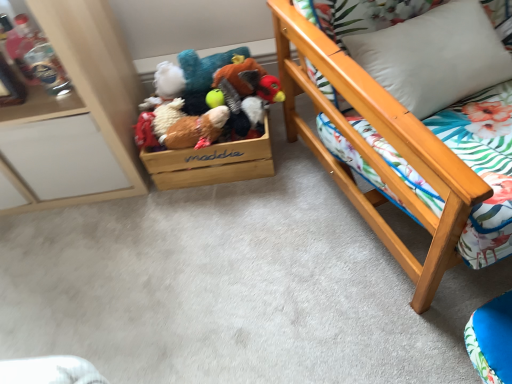
Find the location of a particular element. The width and height of the screenshot is (512, 384). fluffy brown plush at center, acting as the first toy starting from the front is located at coordinates (196, 130).

Measure the distance between fluffy brown plush at center, marked as the second toy in a back-to-front arrangement, and camera.

fluffy brown plush at center, marked as the second toy in a back-to-front arrangement, and camera are 4.20 feet apart.

How much space does wooden cabinet at left, positioned as the second furniture in right-to-left order, occupy horizontally?

The width of wooden cabinet at left, positioned as the second furniture in right-to-left order, is 16.26 inches.

In order to click on wooden plush toys at center, the first toy in the back-to-front sequence in this screenshot , I will do [x=206, y=101].

Image resolution: width=512 pixels, height=384 pixels. In order to click on wooden bed frame at right, arranged as the 2th furniture when viewed from the left in this screenshot , I will do `click(375, 151)`.

Considering the relative sizes of wooden cabinet at left, the 1th furniture from the left, and wooden bed frame at right, arranged as the 2th furniture when viewed from the left, in the image provided, is wooden cabinet at left, the 1th furniture from the left, thinner than wooden bed frame at right, arranged as the 2th furniture when viewed from the left,?

Correct, the width of wooden cabinet at left, the 1th furniture from the left, is less than that of wooden bed frame at right, arranged as the 2th furniture when viewed from the left.

Looking at the image, does wooden cabinet at left, positioned as the second furniture in right-to-left order, seem bigger or smaller compared to wooden bed frame at right, arranged as the 2th furniture when viewed from the left?

In the image, wooden cabinet at left, positioned as the second furniture in right-to-left order, appears to be smaller than wooden bed frame at right, arranged as the 2th furniture when viewed from the left.

Between wooden cabinet at left, the 1th furniture from the left, and wooden bed frame at right, which appears as the 1th furniture when viewed from the right, which one appears on the right side from the viewer's perspective?

wooden bed frame at right, which appears as the 1th furniture when viewed from the right.

Consider the image. Are wooden cabinet at left, the 1th furniture from the left, and wooden bed frame at right, arranged as the 2th furniture when viewed from the left, located far from each other?

wooden cabinet at left, the 1th furniture from the left, is near wooden bed frame at right, arranged as the 2th furniture when viewed from the left, not far away.

Based on the photo, is wooden cabinet at left, the 1th furniture from the left, inside or outside of wooden plush toys at center, the first toy in the back-to-front sequence?

wooden cabinet at left, the 1th furniture from the left, is not inside wooden plush toys at center, the first toy in the back-to-front sequence, it's outside.

Find the location of a particular element. the 2nd toy to the right when counting from the wooden cabinet at left, positioned as the second furniture in right-to-left order is located at coordinates (206, 101).

From a real-world perspective, who is located higher, wooden cabinet at left, positioned as the second furniture in right-to-left order, or wooden plush toys at center, the first toy in the back-to-front sequence?

wooden cabinet at left, positioned as the second furniture in right-to-left order, from a real-world perspective.

From the image's perspective, is wooden cabinet at left, positioned as the second furniture in right-to-left order, under wooden plush toys at center, which is counted as the 2th toy, starting from the front?

Actually, wooden cabinet at left, positioned as the second furniture in right-to-left order, appears above wooden plush toys at center, which is counted as the 2th toy, starting from the front, in the image.

Does wooden plush toys at center, which is counted as the 2th toy, starting from the front, have a larger size compared to fluffy brown plush at center, marked as the second toy in a back-to-front arrangement?

Yes.

Considering the positions of points (198, 68) and (207, 128), is point (198, 68) farther from camera compared to point (207, 128)?

Yes.

Is wooden plush toys at center, the first toy in the back-to-front sequence, at the right side of fluffy brown plush at center, acting as the first toy starting from the front?

Yes, wooden plush toys at center, the first toy in the back-to-front sequence, is to the right of fluffy brown plush at center, acting as the first toy starting from the front.

Considering the sizes of objects wooden plush toys at center, the first toy in the back-to-front sequence, and fluffy brown plush at center, acting as the first toy starting from the front, in the image provided, who is shorter, wooden plush toys at center, the first toy in the back-to-front sequence, or fluffy brown plush at center, acting as the first toy starting from the front,?

fluffy brown plush at center, acting as the first toy starting from the front.

Which is behind, point (423, 33) or point (459, 236)?

Point (423, 33)

Is white soft pillow at upper right not close to wooden bed frame at right, which appears as the 1th furniture when viewed from the right?

No, white soft pillow at upper right is in close proximity to wooden bed frame at right, which appears as the 1th furniture when viewed from the right.

Could you measure the distance between white soft pillow at upper right and wooden bed frame at right, which appears as the 1th furniture when viewed from the right?

The distance of white soft pillow at upper right from wooden bed frame at right, which appears as the 1th furniture when viewed from the right, is 9.59 inches.

Consider the image. From a real-world perspective, between white soft pillow at upper right and wooden bed frame at right, which appears as the 1th furniture when viewed from the right, who is vertically lower?

wooden bed frame at right, which appears as the 1th furniture when viewed from the right, from a real-world perspective.

Is wooden bed frame at right, which appears as the 1th furniture when viewed from the right, oriented towards white soft pillow at upper right?

Yes, wooden bed frame at right, which appears as the 1th furniture when viewed from the right, is aimed at white soft pillow at upper right.

Looking at this image, looking at their sizes, would you say wooden bed frame at right, arranged as the 2th furniture when viewed from the left, is wider or thinner than white soft pillow at upper right?

Clearly, wooden bed frame at right, arranged as the 2th furniture when viewed from the left, has more width compared to white soft pillow at upper right.

Where is `the 2nd toy located beneath the wooden cabinet at left, positioned as the second furniture in right-to-left order (from a real-world perspective)`? Image resolution: width=512 pixels, height=384 pixels. the 2nd toy located beneath the wooden cabinet at left, positioned as the second furniture in right-to-left order (from a real-world perspective) is located at coordinates tap(206, 101).

Is wooden plush toys at center, the first toy in the back-to-front sequence, situated inside wooden cabinet at left, the 1th furniture from the left, or outside?

wooden plush toys at center, the first toy in the back-to-front sequence, is not enclosed by wooden cabinet at left, the 1th furniture from the left.

Which is more to the left, wooden plush toys at center, the first toy in the back-to-front sequence, or wooden cabinet at left, positioned as the second furniture in right-to-left order?

Positioned to the left is wooden cabinet at left, positioned as the second furniture in right-to-left order.

Who is bigger, wooden plush toys at center, which is counted as the 2th toy, starting from the front, or wooden cabinet at left, the 1th furniture from the left?

With larger size is wooden cabinet at left, the 1th furniture from the left.

From a real-world perspective, is wooden bed frame at right, arranged as the 2th furniture when viewed from the left, located higher than fluffy brown plush at center, acting as the first toy starting from the front?

Yes, from a real-world perspective, wooden bed frame at right, arranged as the 2th furniture when viewed from the left, is above fluffy brown plush at center, acting as the first toy starting from the front.

Looking at this image, considering the relative sizes of wooden bed frame at right, which appears as the 1th furniture when viewed from the right, and fluffy brown plush at center, acting as the first toy starting from the front, in the image provided, is wooden bed frame at right, which appears as the 1th furniture when viewed from the right, taller than fluffy brown plush at center, acting as the first toy starting from the front,?

Yes, wooden bed frame at right, which appears as the 1th furniture when viewed from the right, is taller than fluffy brown plush at center, acting as the first toy starting from the front.

How different are the orientations of wooden bed frame at right, which appears as the 1th furniture when viewed from the right, and fluffy brown plush at center, acting as the first toy starting from the front, in degrees?

They differ by 20 degrees in their facing directions.

Considering the sizes of wooden bed frame at right, arranged as the 2th furniture when viewed from the left, and fluffy brown plush at center, marked as the second toy in a back-to-front arrangement, in the image, is wooden bed frame at right, arranged as the 2th furniture when viewed from the left, bigger or smaller than fluffy brown plush at center, marked as the second toy in a back-to-front arrangement,?

Considering their sizes, wooden bed frame at right, arranged as the 2th furniture when viewed from the left, takes up more space than fluffy brown plush at center, marked as the second toy in a back-to-front arrangement.

The image size is (512, 384). What are the coordinates of `furniture above the wooden cabinet at left, positioned as the second furniture in right-to-left order (from a real-world perspective)` in the screenshot? It's located at (375, 151).

Where is `the 2nd toy counting from the right side of the wooden cabinet at left, the 1th furniture from the left`? The height and width of the screenshot is (384, 512). the 2nd toy counting from the right side of the wooden cabinet at left, the 1th furniture from the left is located at coordinates (206, 101).

Looking at this image, when comparing their distances from wooden cabinet at left, positioned as the second furniture in right-to-left order, does wooden plush toys at center, the first toy in the back-to-front sequence, or fluffy brown plush at center, marked as the second toy in a back-to-front arrangement, seem closer?

Among the two, wooden plush toys at center, the first toy in the back-to-front sequence, is located nearer to wooden cabinet at left, positioned as the second furniture in right-to-left order.

When comparing their distances from wooden plush toys at center, the first toy in the back-to-front sequence, does white soft pillow at upper right or wooden cabinet at left, the 1th furniture from the left, seem closer?

wooden cabinet at left, the 1th furniture from the left, is positioned closer to the anchor wooden plush toys at center, the first toy in the back-to-front sequence.

Looking at the image, which one is located closer to fluffy brown plush at center, acting as the first toy starting from the front, white soft pillow at upper right or wooden cabinet at left, positioned as the second furniture in right-to-left order?

Among the two, wooden cabinet at left, positioned as the second furniture in right-to-left order, is located nearer to fluffy brown plush at center, acting as the first toy starting from the front.

Considering their positions, is wooden cabinet at left, positioned as the second furniture in right-to-left order, positioned closer to white soft pillow at upper right than wooden plush toys at center, the first toy in the back-to-front sequence?

The object closer to white soft pillow at upper right is wooden plush toys at center, the first toy in the back-to-front sequence.

Considering their positions, is white soft pillow at upper right positioned closer to wooden plush toys at center, the first toy in the back-to-front sequence, than wooden bed frame at right, which appears as the 1th furniture when viewed from the right?

The object closer to wooden plush toys at center, the first toy in the back-to-front sequence, is wooden bed frame at right, which appears as the 1th furniture when viewed from the right.

When comparing their distances from fluffy brown plush at center, marked as the second toy in a back-to-front arrangement, does wooden plush toys at center, the first toy in the back-to-front sequence, or wooden cabinet at left, the 1th furniture from the left, seem closer?

wooden plush toys at center, the first toy in the back-to-front sequence, is closer to fluffy brown plush at center, marked as the second toy in a back-to-front arrangement.

When comparing their distances from wooden bed frame at right, arranged as the 2th furniture when viewed from the left, does wooden plush toys at center, the first toy in the back-to-front sequence, or wooden cabinet at left, the 1th furniture from the left, seem closer?

The object closer to wooden bed frame at right, arranged as the 2th furniture when viewed from the left, is wooden plush toys at center, the first toy in the back-to-front sequence.

When comparing their distances from wooden bed frame at right, which appears as the 1th furniture when viewed from the right, does wooden cabinet at left, positioned as the second furniture in right-to-left order, or fluffy brown plush at center, marked as the second toy in a back-to-front arrangement, seem closer?

fluffy brown plush at center, marked as the second toy in a back-to-front arrangement, is closer to wooden bed frame at right, which appears as the 1th furniture when viewed from the right.

You are a GUI agent. You are given a task and a screenshot of the screen. Output one action in this format:
    pyautogui.click(x=<x>, y=<y>)
    Task: Click on the pillow located between wooden bed frame at right, arranged as the 2th furniture when viewed from the left, and wooden plush toys at center, which is counted as the 2th toy, starting from the front, in the depth direction
    Image resolution: width=512 pixels, height=384 pixels.
    Given the screenshot: What is the action you would take?
    pyautogui.click(x=434, y=57)

The height and width of the screenshot is (384, 512). I want to click on toy between wooden cabinet at left, the 1th furniture from the left, and wooden plush toys at center, which is counted as the 2th toy, starting from the front, from left to right, so click(x=196, y=130).

Find the location of `pillow between wooden bed frame at right, which appears as the 1th furniture when viewed from the right, and fluffy brown plush at center, marked as the second toy in a back-to-front arrangement, along the z-axis`. pillow between wooden bed frame at right, which appears as the 1th furniture when viewed from the right, and fluffy brown plush at center, marked as the second toy in a back-to-front arrangement, along the z-axis is located at coordinates (434, 57).

This screenshot has width=512, height=384. What are the coordinates of `pillow located between wooden cabinet at left, the 1th furniture from the left, and wooden bed frame at right, arranged as the 2th furniture when viewed from the left, in the left-right direction` in the screenshot? It's located at click(x=434, y=57).